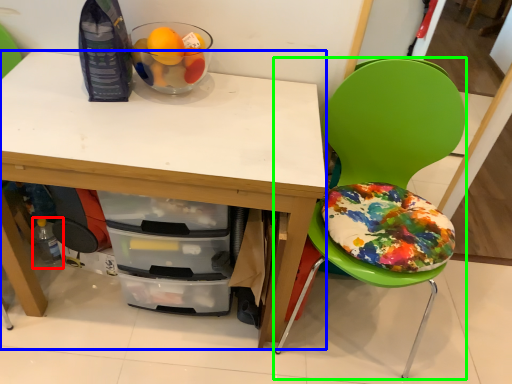
Question: Considering the real-world distances, which object is closest to bottle (highlighted by a red box)? desk (highlighted by a blue box) or chair (highlighted by a green box).

Choices:
 (A) desk
 (B) chair

Answer: (A)